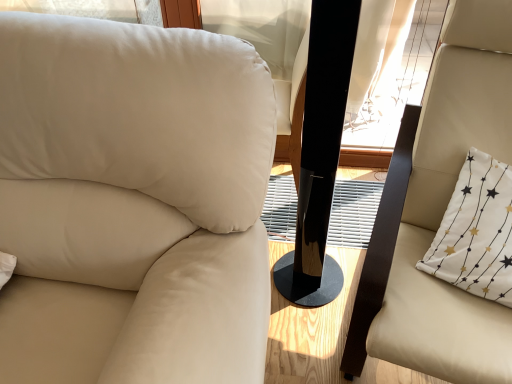
The width and height of the screenshot is (512, 384). What do you see at coordinates (320, 154) in the screenshot?
I see `black glossy speaker at center` at bounding box center [320, 154].

This screenshot has height=384, width=512. What do you see at coordinates (439, 212) in the screenshot?
I see `beige leather chair at right, the 2th chair positioned from the left` at bounding box center [439, 212].

Consider the image. What is the approximate width of beige leather chair at left, which is counted as the 1th chair, starting from the left?

The width of beige leather chair at left, which is counted as the 1th chair, starting from the left, is 28.05 inches.

What do you see at coordinates (476, 231) in the screenshot? I see `white fabric pillow at right` at bounding box center [476, 231].

The image size is (512, 384). What are the coordinates of `black glossy speaker at center` in the screenshot? It's located at (320, 154).

Is beige leather chair at right, the 2th chair positioned from the left, in front of or behind black glossy speaker at center in the image?

beige leather chair at right, the 2th chair positioned from the left, is positioned closer to the viewer than black glossy speaker at center.

From a real-world perspective, is beige leather chair at right, the 1th chair viewed from the right, positioned above or below black glossy speaker at center?

Clearly, from a real-world perspective, beige leather chair at right, the 1th chair viewed from the right, is above black glossy speaker at center.

The height and width of the screenshot is (384, 512). What are the coordinates of `chair above the black glossy speaker at center (from a real-world perspective)` in the screenshot? It's located at (439, 212).

In the scene shown: From the image's perspective, which one is positioned lower, beige leather chair at right, the 1th chair viewed from the right, or black glossy speaker at center?

beige leather chair at right, the 1th chair viewed from the right, appears lower in the image.

From a real-world perspective, is beige leather chair at left, which is counted as the 1th chair, starting from the left, above or below white fabric pillow at right?

From a real-world perspective, beige leather chair at left, which is counted as the 1th chair, starting from the left, is physically above white fabric pillow at right.

Which object is wider, beige leather chair at left, which is counted as the 1th chair, starting from the left, or white fabric pillow at right?

beige leather chair at left, which is counted as the 1th chair, starting from the left.

Which is closer, (x=104, y=157) or (x=456, y=235)?

The point (x=104, y=157) is in front.

Is beige leather chair at left, placed as the 2th chair when sorted from right to left, behind white fabric pillow at right?

No, the depth of beige leather chair at left, placed as the 2th chair when sorted from right to left, is less than that of white fabric pillow at right.

Which object is positioned more to the left, black glossy speaker at center or white fabric pillow at right?

black glossy speaker at center.

Measure the distance from black glossy speaker at center to white fabric pillow at right.

16.28 inches.

From a real-world perspective, does black glossy speaker at center stand above white fabric pillow at right?

Yes, from a real-world perspective, black glossy speaker at center is over white fabric pillow at right

The height and width of the screenshot is (384, 512). Find the location of `pillar located in front of the white fabric pillow at right`. pillar located in front of the white fabric pillow at right is located at coordinates (320, 154).

Which is in front, point (121, 198) or point (423, 320)?

Point (121, 198)

How distant is beige leather chair at left, placed as the 2th chair when sorted from right to left, from beige leather chair at right, the 2th chair positioned from the left?

beige leather chair at left, placed as the 2th chair when sorted from right to left, is 22.40 inches away from beige leather chair at right, the 2th chair positioned from the left.

Identify the location of chair below the beige leather chair at right, the 1th chair viewed from the right (from the image's perspective). This screenshot has width=512, height=384. (143, 185).

Is beige leather chair at left, placed as the 2th chair when sorted from right to left, behind beige leather chair at right, the 1th chair viewed from the right?

No, the depth of beige leather chair at left, placed as the 2th chair when sorted from right to left, is less than that of beige leather chair at right, the 1th chair viewed from the right.

Is white fabric pillow at right taller or shorter than beige leather chair at right, the 2th chair positioned from the left?

In the image, white fabric pillow at right appears to be shorter than beige leather chair at right, the 2th chair positioned from the left.

Is white fabric pillow at right turned away from beige leather chair at right, the 2th chair positioned from the left?

Yes.

Does white fabric pillow at right come in front of beige leather chair at right, the 1th chair viewed from the right?

No, it is behind beige leather chair at right, the 1th chair viewed from the right.

Between white fabric pillow at right and beige leather chair at right, the 2th chair positioned from the left, which one appears on the left side from the viewer's perspective?

Positioned to the left is beige leather chair at right, the 2th chair positioned from the left.

Does point (277, 282) appear closer or farther from the camera than point (143, 126)?

Point (277, 282) is farther from the camera than point (143, 126).

Can you confirm if black glossy speaker at center is bigger than beige leather chair at left, which is counted as the 1th chair, starting from the left?

Actually, black glossy speaker at center might be smaller than beige leather chair at left, which is counted as the 1th chair, starting from the left.

From the image's perspective, between black glossy speaker at center and beige leather chair at left, which is counted as the 1th chair, starting from the left, who is located below?

From the image's view, beige leather chair at left, which is counted as the 1th chair, starting from the left, is below.

From a real-world perspective, which object stands above the other?

black glossy speaker at center, from a real-world perspective.

What's the angular difference between black glossy speaker at center and beige leather chair at right, the 2th chair positioned from the left,'s facing directions?

There is a 9.26-degree angle between the facing directions of black glossy speaker at center and beige leather chair at right, the 2th chair positioned from the left.

From a real-world perspective, which object stands above the other?

beige leather chair at right, the 2th chair positioned from the left, from a real-world perspective.

From the image's perspective, is black glossy speaker at center on top of beige leather chair at right, the 1th chair viewed from the right?

Yes, from the image's perspective, black glossy speaker at center is on top of beige leather chair at right, the 1th chair viewed from the right.

In the image, is black glossy speaker at center positioned in front of or behind beige leather chair at right, the 2th chair positioned from the left?

black glossy speaker at center is behind beige leather chair at right, the 2th chair positioned from the left.

From the image's perspective, count 1st chairs downward from the black glossy speaker at center and point to it. Please provide its 2D coordinates.

[(439, 212)]

Where is `chair that is the 2nd object located in front of the white fabric pillow at right`? The height and width of the screenshot is (384, 512). chair that is the 2nd object located in front of the white fabric pillow at right is located at coordinates (143, 185).

From the image, which object appears to be farther from black glossy speaker at center, beige leather chair at right, the 2th chair positioned from the left, or beige leather chair at left, placed as the 2th chair when sorted from right to left?

The object further to black glossy speaker at center is beige leather chair at left, placed as the 2th chair when sorted from right to left.

Estimate the real-world distances between objects in this image. Which object is further from beige leather chair at left, which is counted as the 1th chair, starting from the left, black glossy speaker at center or white fabric pillow at right?

white fabric pillow at right lies further to beige leather chair at left, which is counted as the 1th chair, starting from the left, than the other object.

Looking at this image, considering their positions, is black glossy speaker at center positioned further to beige leather chair at right, the 2th chair positioned from the left, than beige leather chair at left, placed as the 2th chair when sorted from right to left?

beige leather chair at left, placed as the 2th chair when sorted from right to left, is positioned further to the anchor beige leather chair at right, the 2th chair positioned from the left.

Estimate the real-world distances between objects in this image. Which object is further from beige leather chair at left, which is counted as the 1th chair, starting from the left, beige leather chair at right, the 2th chair positioned from the left, or white fabric pillow at right?

white fabric pillow at right is further to beige leather chair at left, which is counted as the 1th chair, starting from the left.

Considering their positions, is beige leather chair at left, placed as the 2th chair when sorted from right to left, positioned closer to black glossy speaker at center than white fabric pillow at right?

Based on the image, white fabric pillow at right appears to be nearer to black glossy speaker at center.

Which object lies further to the anchor point beige leather chair at right, the 1th chair viewed from the right, beige leather chair at left, placed as the 2th chair when sorted from right to left, or white fabric pillow at right?

The object further to beige leather chair at right, the 1th chair viewed from the right, is beige leather chair at left, placed as the 2th chair when sorted from right to left.

From the image, which object appears to be nearer to beige leather chair at right, the 1th chair viewed from the right, white fabric pillow at right or beige leather chair at left, which is counted as the 1th chair, starting from the left?

white fabric pillow at right.

In the scene shown: Considering their positions, is beige leather chair at right, the 2th chair positioned from the left, positioned further to black glossy speaker at center than white fabric pillow at right?

white fabric pillow at right.

This screenshot has width=512, height=384. In order to click on pillar located between beige leather chair at left, placed as the 2th chair when sorted from right to left, and beige leather chair at right, the 1th chair viewed from the right, in the left-right direction in this screenshot , I will do `click(320, 154)`.

Locate an element on the screen. The height and width of the screenshot is (384, 512). pillar positioned between beige leather chair at right, the 2th chair positioned from the left, and white fabric pillow at right from near to far is located at coordinates (320, 154).

This screenshot has width=512, height=384. What are the coordinates of `chair situated between beige leather chair at left, which is counted as the 1th chair, starting from the left, and white fabric pillow at right from left to right` in the screenshot? It's located at (439, 212).

Locate an element on the screen. The height and width of the screenshot is (384, 512). pillar between beige leather chair at left, which is counted as the 1th chair, starting from the left, and white fabric pillow at right is located at coordinates (320, 154).